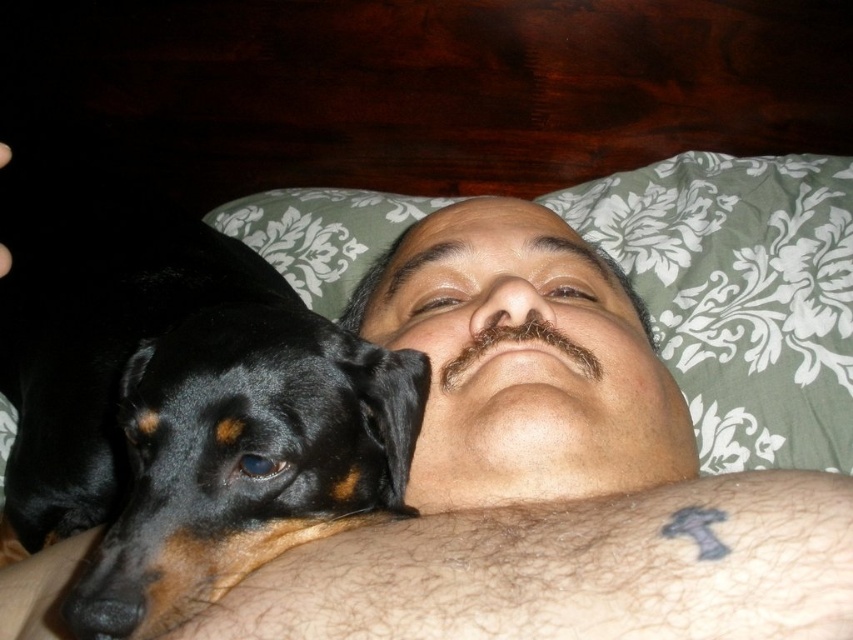
Who is more forward, (126, 483) or (695, 332)?

Point (126, 483) is in front.

From the picture: Does black shiny dog at left appear on the left side of green floral pillow at upper center?

Indeed, black shiny dog at left is positioned on the left side of green floral pillow at upper center.

Which is behind, point (183, 404) or point (836, 282)?

Positioned behind is point (836, 282).

Identify the location of black shiny dog at left. (180, 404).